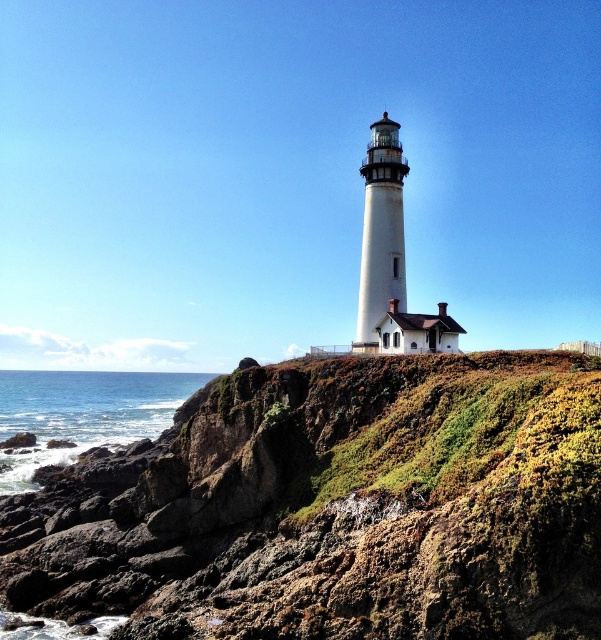
Question: Which point appears closest to the camera in this image?

Choices:
 (A) (31, 451)
 (B) (32, 593)

Answer: (B)

Question: Can you confirm if green mossy rock at center is positioned to the right of blue water at lower left?

Choices:
 (A) no
 (B) yes

Answer: (B)

Question: Can you confirm if green mossy rock at center is wider than blue water at lower left?

Choices:
 (A) no
 (B) yes

Answer: (A)

Question: Which object appears closest to the camera in this image?

Choices:
 (A) blue water at lower left
 (B) green mossy rock at center

Answer: (B)

Question: Is green mossy rock at center to the left of blue water at lower left from the viewer's perspective?

Choices:
 (A) no
 (B) yes

Answer: (A)